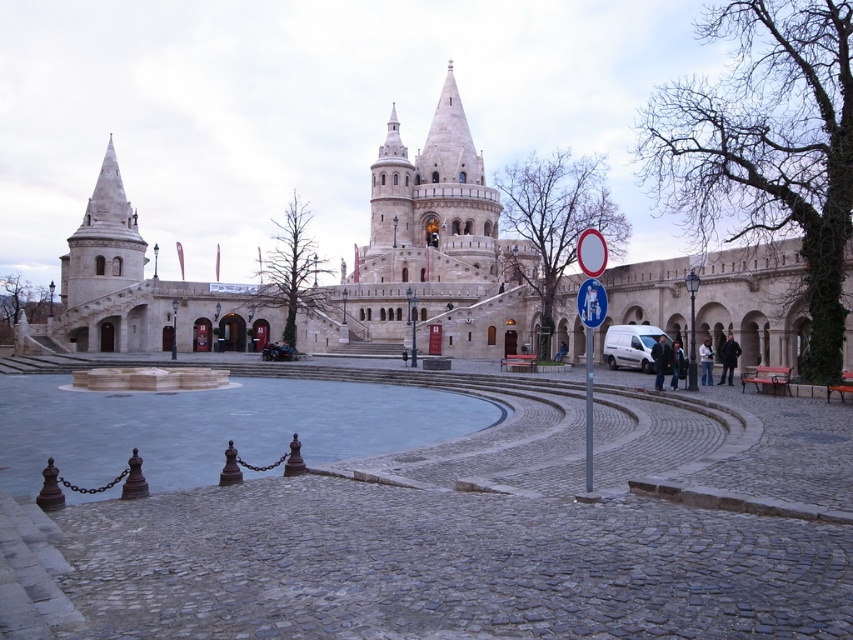
Question: Which is nearer to the dark blue jacket at center?

Choices:
 (A) light blue jeans at center
 (B) metallic pole at right

Answer: (B)

Question: Among these points, which one is farthest from the camera?

Choices:
 (A) (689, 282)
 (B) (584, 305)
 (C) (109, 205)
 (D) (682, 356)

Answer: (C)

Question: Can you confirm if blue plastic sign at center is positioned to the right of metallic street sign at center?

Choices:
 (A) yes
 (B) no

Answer: (A)

Question: Based on their relative distances, which object is farther from the metallic street sign at center?

Choices:
 (A) white matte van at lower right
 (B) metallic pole at right
 (C) gray cobblestone plaza at center
 (D) black wool coat at lower right

Answer: (C)

Question: Does black wool coat at lower right have a smaller size compared to metallic street sign at center?

Choices:
 (A) no
 (B) yes

Answer: (B)

Question: Does dark blue jacket at center appear on the right side of dark gray fabric coat at lower right?

Choices:
 (A) yes
 (B) no

Answer: (B)